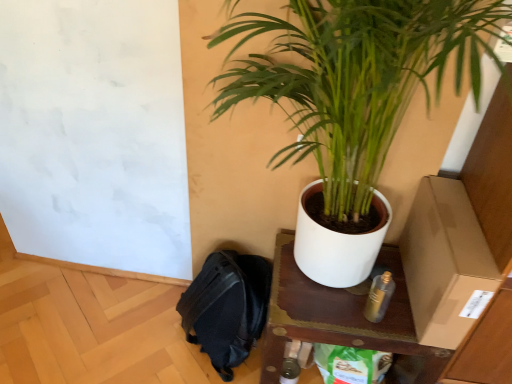
Locate an element on the screen. This screenshot has width=512, height=384. vacant space situated on the left part of metallic gold spray can at lower right is located at coordinates (320, 308).